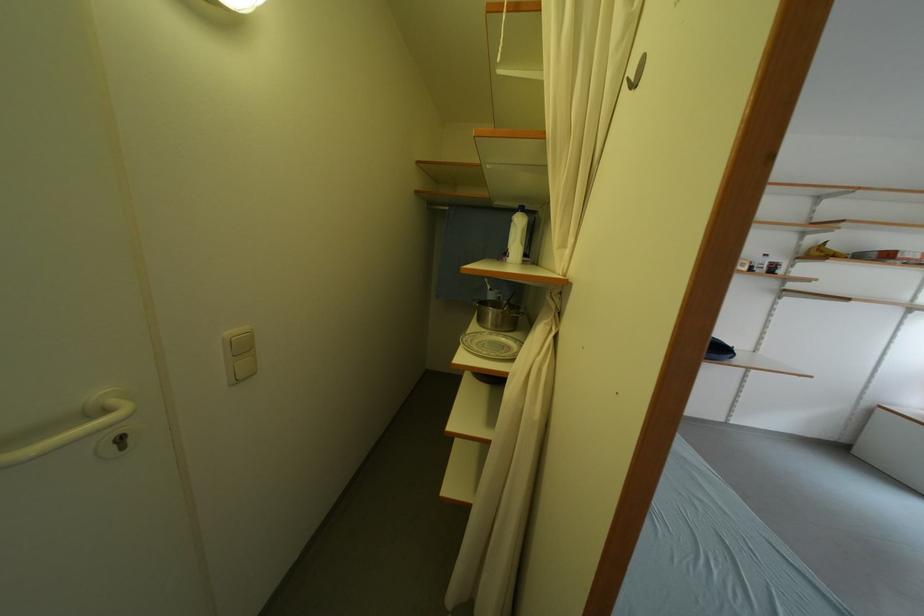
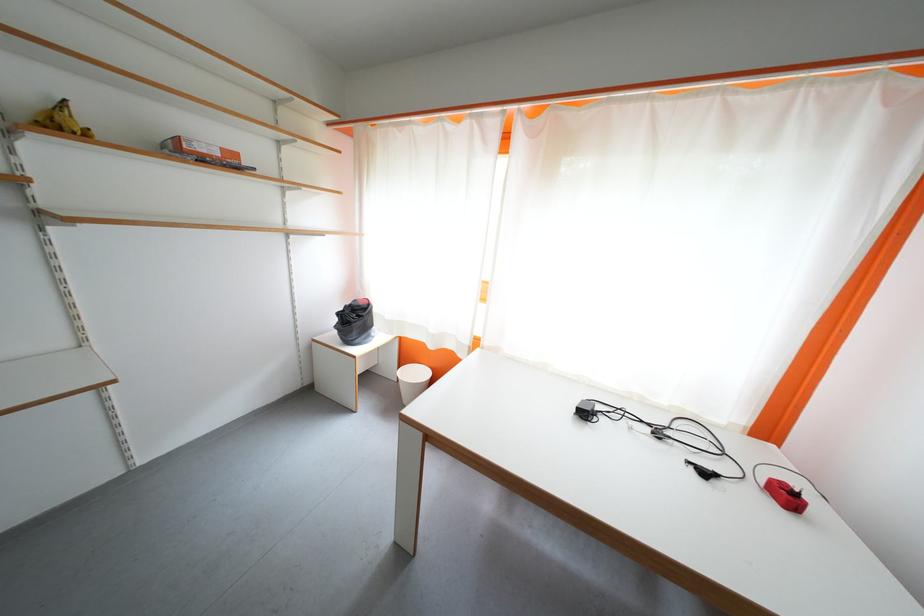
In the second image, find the point that corresponds to (829,257) in the first image.

(68, 129)